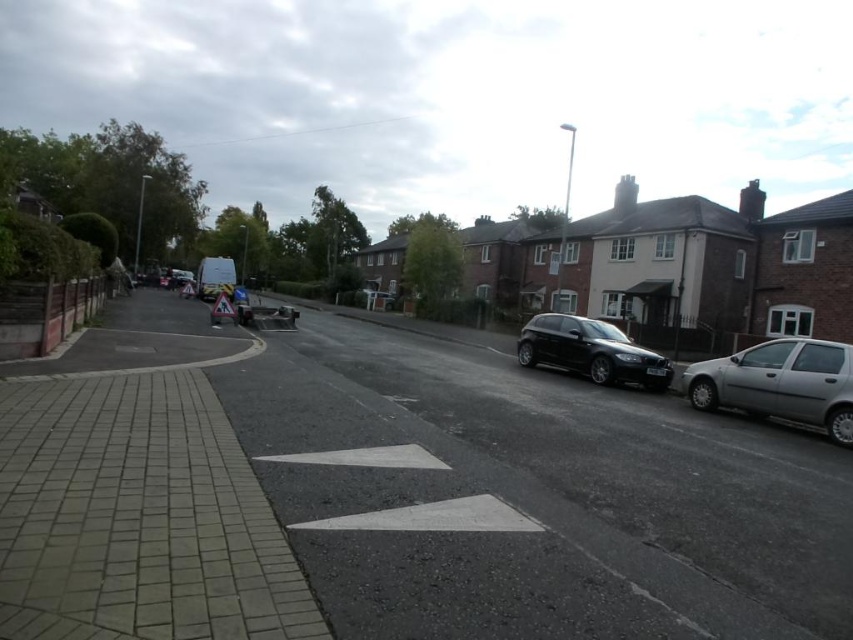
You are a pedestrian standing on the sidewalk and want to cross the street to reach the shiny black hatchback at center. Is the silver metallic hatchback at right blocking your path?

The silver metallic hatchback at right is in front of the shiny black hatchback at center, so it is blocking the path to the shiny black hatchback at center.

Based on the photo, you are a delivery driver approaching the construction zone indicated by the triangular sign. You need to park your delivery van, which is 2 meters wide, between the silver metallic hatchback at right and the shiny black hatchback at center. Is there enough space between them to park your van?

The silver metallic hatchback at right is positioned on the right side of shiny black hatchback at center, but the exact distance between them isn not provided. Without knowing the space between them, it is impossible to determine if the van can fit.

You are a delivery driver who needs to park your 2.5 meters wide truck between the silver metallic hatchback at right and the shiny black hatchback at center. Can your truck fit in the space between them?

The silver metallic hatchback at right is narrower than the shiny black hatchback at center. The space between them may vary depending on their positions, but since the silver metallic hatchback at right is narrower, there might be enough space. However, without knowing the exact distance between them, it is uncertain if the 2.5 meters wide truck can fit.